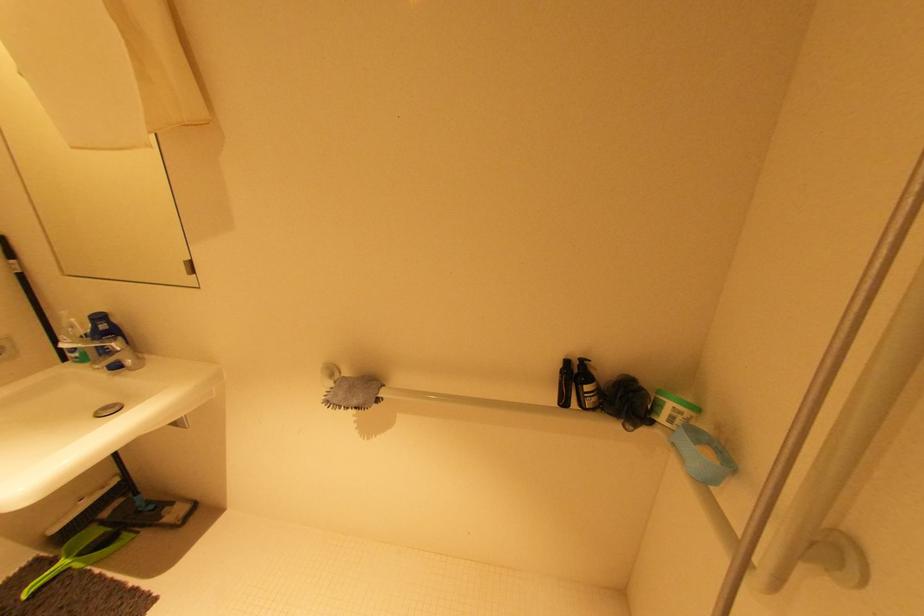
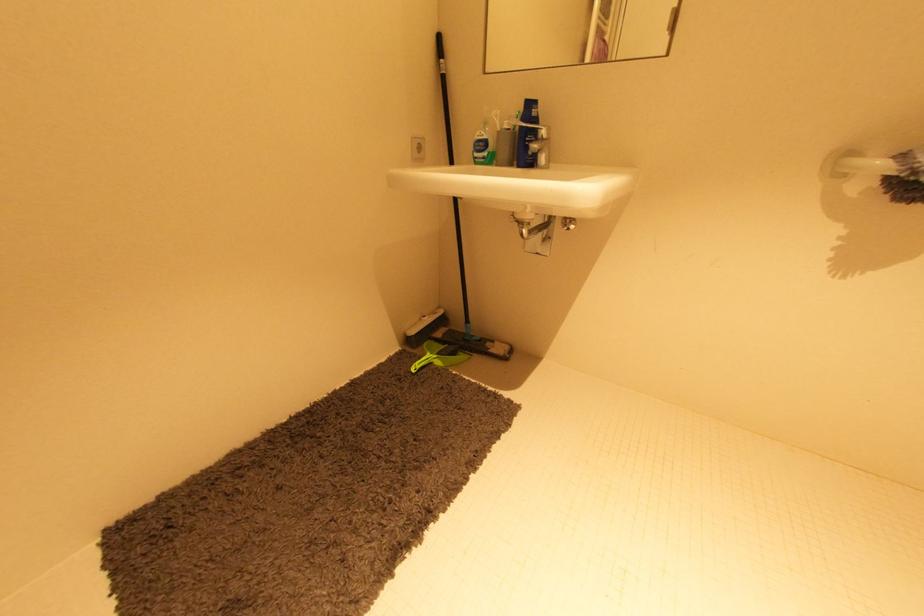
Question: Which direction would the cameraman need to move to produce the second image? Reply with the corresponding letter.

Choices:
 (A) Left
 (B) Right
 (C) Forward
 (D) Backward

Answer: (A)